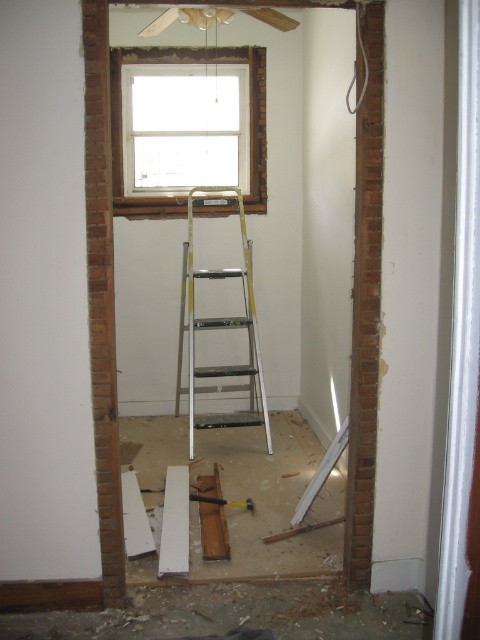
Question: Which of the following is the closest to the observer?

Choices:
 (A) metallic silver hammer at lower center
 (B) wooden frame at upper center
 (C) white matte beam at center
 (D) white plastic beam at lower right

Answer: (C)

Question: Does wooden frame at upper center have a greater width compared to metallic silver hammer at lower center?

Choices:
 (A) no
 (B) yes

Answer: (B)

Question: Which of the following is the closest to the observer?

Choices:
 (A) (342, 449)
 (B) (213, 502)
 (C) (252, 125)
 (D) (192, 204)

Answer: (A)

Question: Is wooden frame at upper center positioned before white matte beam at center?

Choices:
 (A) no
 (B) yes

Answer: (A)

Question: Among these points, which one is farthest from the camera?

Choices:
 (A) (231, 365)
 (B) (331, 460)
 (C) (207, 52)
 (D) (219, 500)

Answer: (C)

Question: Is white matte beam at center above white plastic beam at lower right?

Choices:
 (A) no
 (B) yes

Answer: (A)